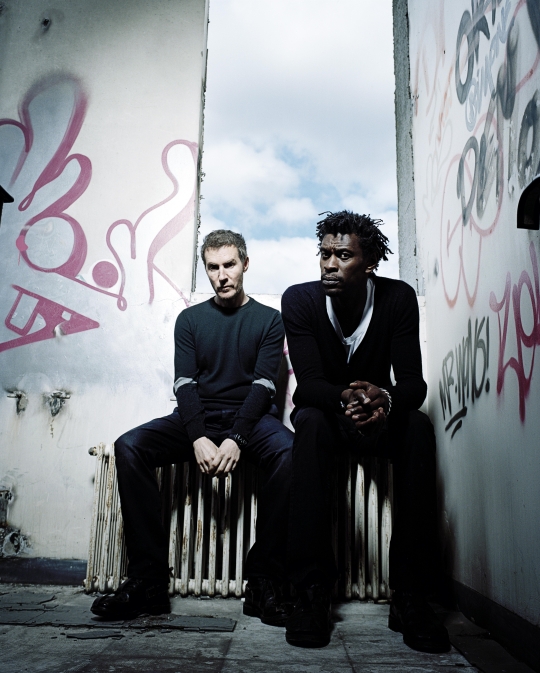
Where is `radiator`? Image resolution: width=540 pixels, height=673 pixels. radiator is located at coordinates (194, 544).